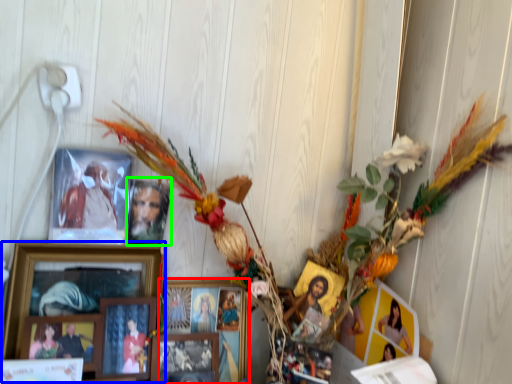
Question: Which is nearer to the picture frame (highlighted by a red box)? picture frame (highlighted by a blue box) or picture frame (highlighted by a green box).

Choices:
 (A) picture frame
 (B) picture frame

Answer: (A)